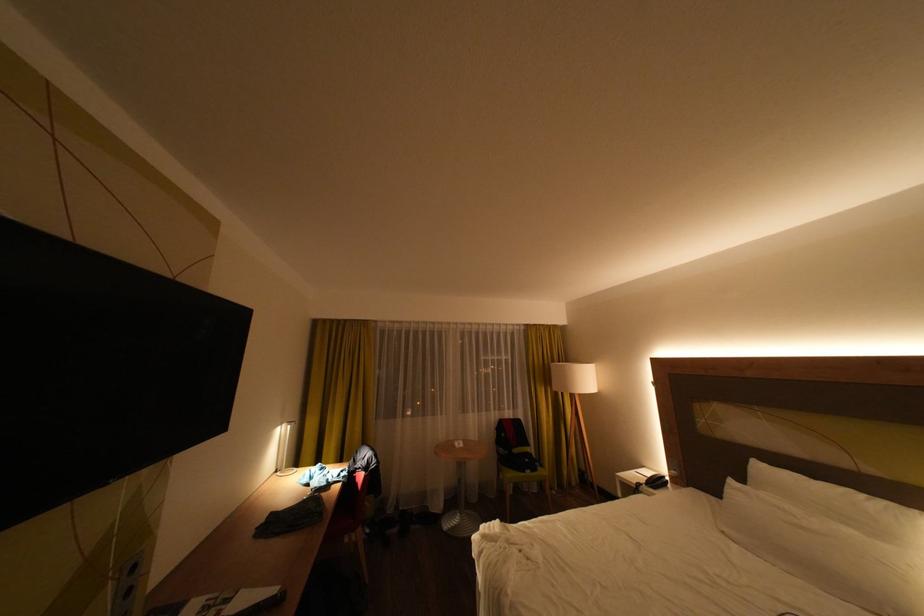
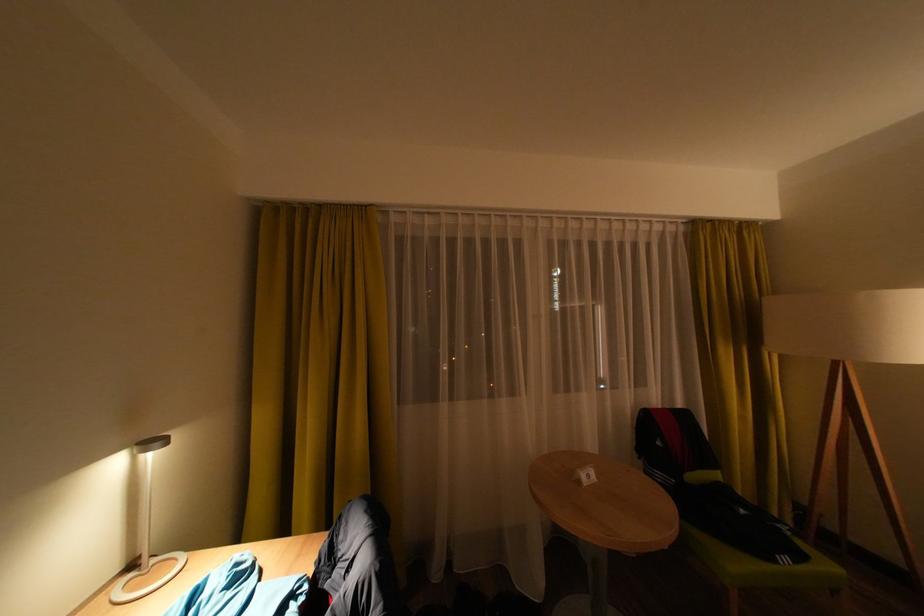
Question: What movement of the cameraman would produce the second image?

Choices:
 (A) Left
 (B) Right
 (C) Forward
 (D) Backward

Answer: (C)